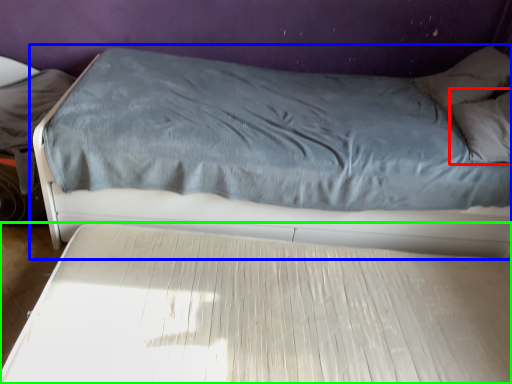
Question: Which is farther away from pillow (highlighted by a red box)? bed (highlighted by a blue box) or bed (highlighted by a green box)?

Choices:
 (A) bed
 (B) bed

Answer: (B)